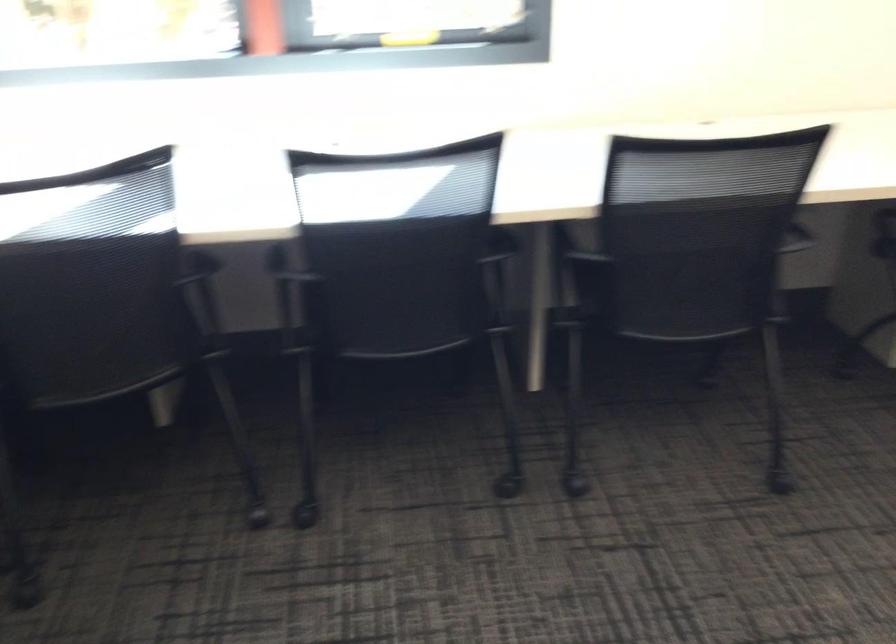
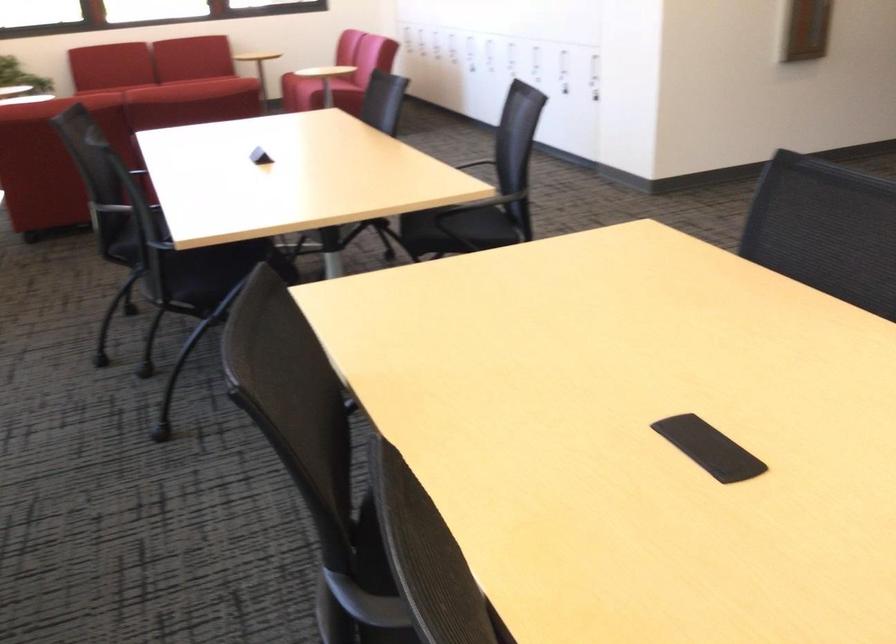
First-person continuous shooting, in which direction is the camera rotating?

The camera rotated toward right-down.